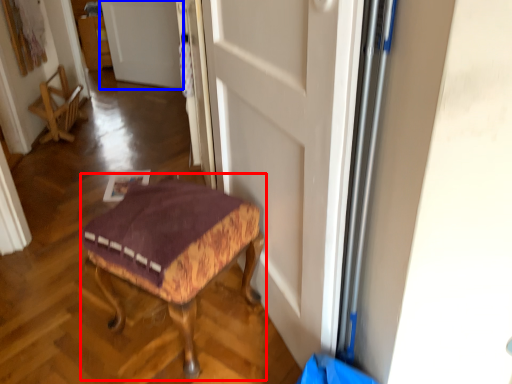
Question: Which of the following is the closest to the observer, furniture (highlighted by a red box) or door (highlighted by a blue box)?

Choices:
 (A) furniture
 (B) door

Answer: (A)